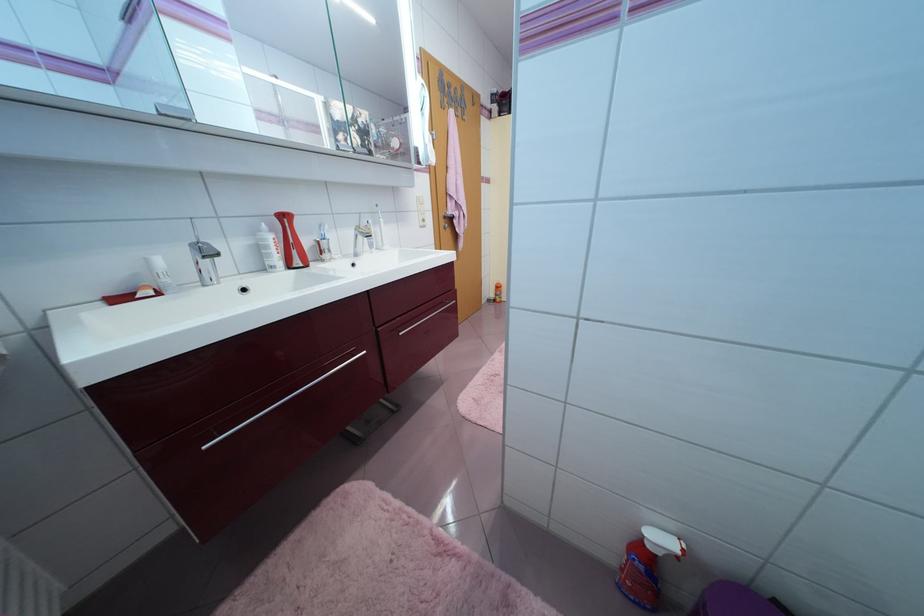
What do you see at coordinates (663, 541) in the screenshot? This screenshot has width=924, height=616. I see `the white spray trigger` at bounding box center [663, 541].